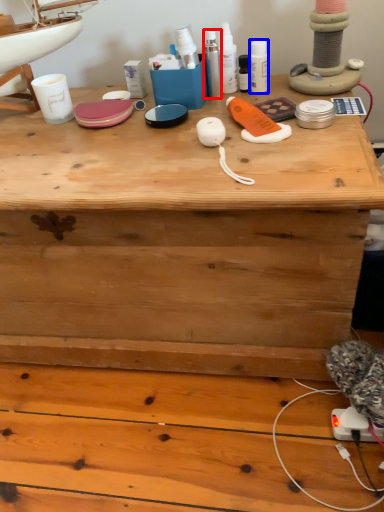
Question: Which of the following is the closest to the observer, toiletry (highlighted by a red box) or toiletry (highlighted by a blue box)?

Choices:
 (A) toiletry
 (B) toiletry

Answer: (A)